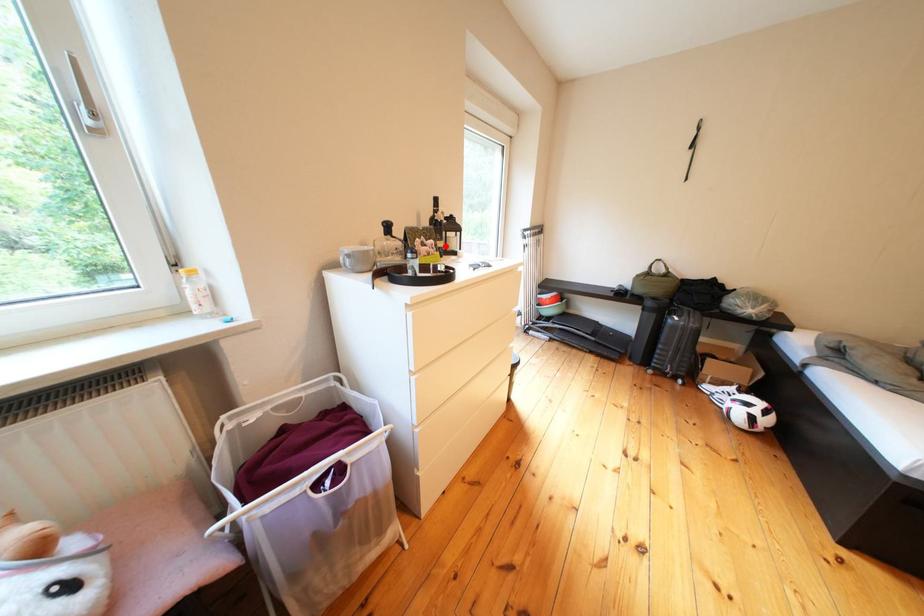
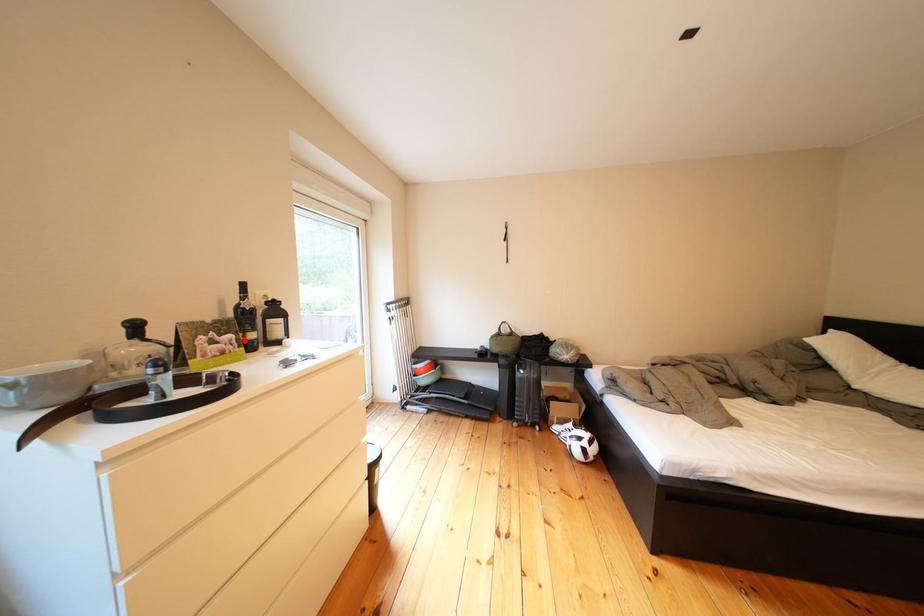
I am providing you with two images of the same scene from different viewpoints. A red point is marked on the first image and another point is marked on the second image. Do the highlighted points in image1 and image2 indicate the same real-world spot?

Yes